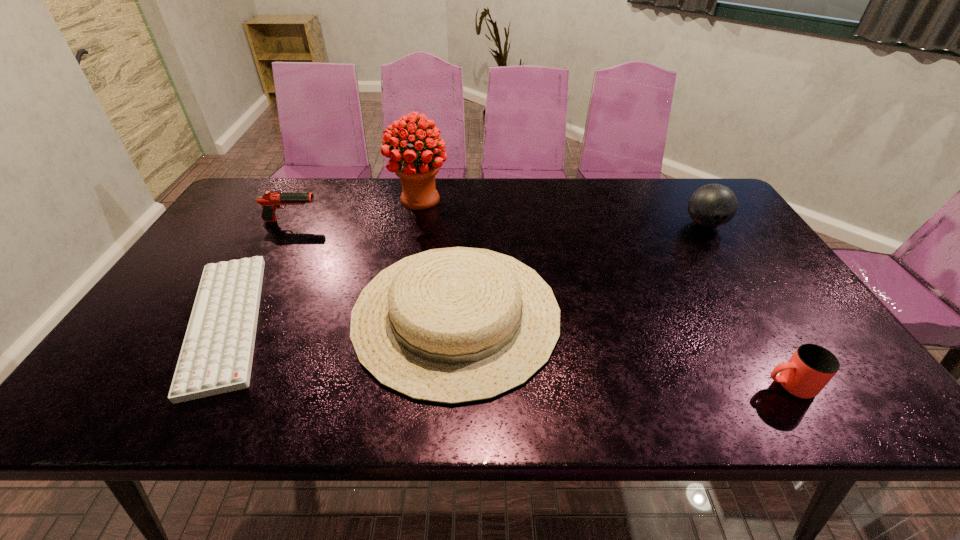
Locate an element on the screen. This screenshot has height=540, width=960. free spot located on the handle side of the cup is located at coordinates (622, 386).

The height and width of the screenshot is (540, 960). In order to click on vacant space located 0.200m on the handle side of the cup in this screenshot , I will do `click(669, 386)`.

Image resolution: width=960 pixels, height=540 pixels. In order to click on free region located on the handle side of the cup in this screenshot , I will do `click(726, 386)`.

The image size is (960, 540). I want to click on vacant space located on the back of the shortest object, so click(288, 213).

Image resolution: width=960 pixels, height=540 pixels. In order to click on bouquet positioned at the far edge in this screenshot , I will do coord(417,171).

Find the location of a particular element. The width and height of the screenshot is (960, 540). bowling ball at the far edge is located at coordinates (713, 205).

At what (x,y) coordinates should I click in order to perform the action: click on sunhat situated at the near edge. Please return your answer as a coordinate pair (x, y). Looking at the image, I should click on (454, 325).

I want to click on cup that is at the near edge, so click(810, 368).

The height and width of the screenshot is (540, 960). In order to click on computer keyboard that is at the near edge in this screenshot , I will do `click(216, 357)`.

Locate an element on the screen. The height and width of the screenshot is (540, 960). gun positioned at the left edge is located at coordinates (271, 200).